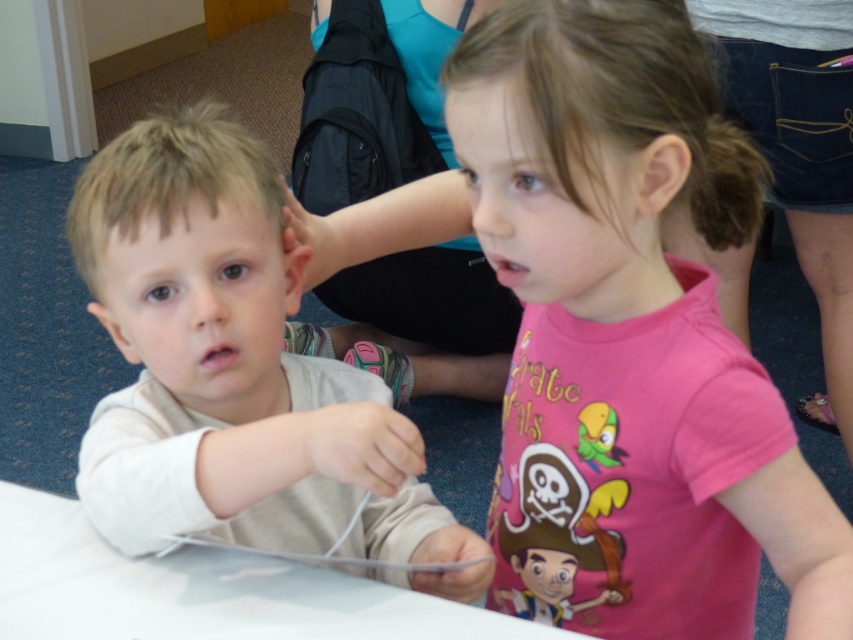
You are a photographer trying to capture a closeup of the pink cotton shirt at center without the light beige shirt at left blocking the view. Based on their positions, can you position yourself in a way to achieve this?

Yes, since the pink cotton shirt at center is in front of the light beige shirt at left, you can position yourself directly facing the pink cotton shirt at center to avoid the light beige shirt at left blocking the view.

You are standing at the origin point in the image. You want to move towards the point at coordinates point (x=257, y=474). However, there is an obstacle located at point (x=583, y=317). Will you encounter this obstacle before reaching your destination?

Yes, you will encounter the obstacle at point (x=583, y=317) before reaching point (x=257, y=474) because point (x=583, y=317) is behind point (x=257, y=474).

You are a tailor measuring shirts for a customer. You have two shirts in front of you, the pink cotton shirt at center and the light beige shirt at left. The customer wants to know which shirt is taller. What do you tell them?

The pink cotton shirt at center is taller than the light beige shirt at left.